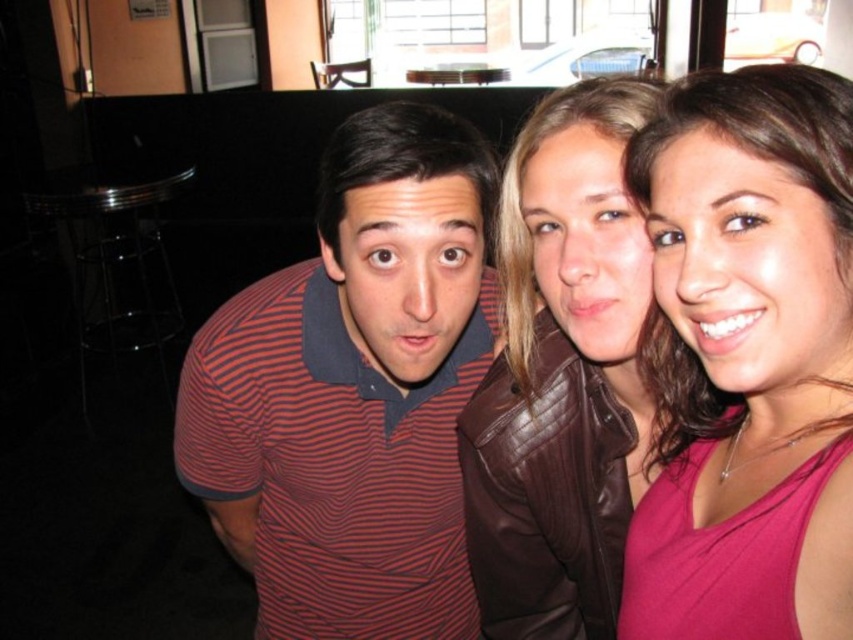
Question: Is striped cotton polo shirt at center thinner than pink matte tank top at center?

Choices:
 (A) yes
 (B) no

Answer: (B)

Question: Which object is closer to the camera taking this photo?

Choices:
 (A) striped polo shirt at center
 (B) pink matte tank top at center

Answer: (B)

Question: In this image, where is pink matte tank top at center located relative to striped polo shirt at center?

Choices:
 (A) left
 (B) right

Answer: (B)

Question: Which object is closer to the camera taking this photo?

Choices:
 (A) striped polo shirt at center
 (B) striped cotton polo shirt at center
 (C) brown leather jacket at upper right

Answer: (A)

Question: Does pink matte tank top at center have a smaller size compared to striped polo shirt at center?

Choices:
 (A) yes
 (B) no

Answer: (A)

Question: Which object is closer to the camera taking this photo?

Choices:
 (A) brown leather jacket at upper right
 (B) pink matte tank top at center

Answer: (B)